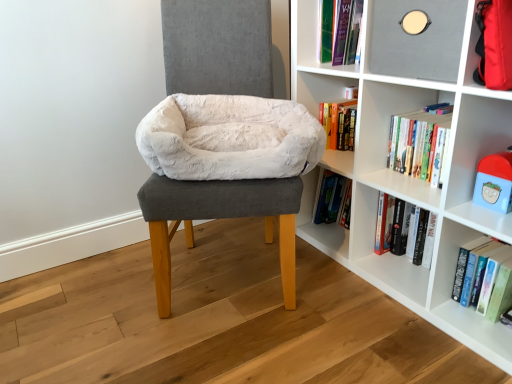
The height and width of the screenshot is (384, 512). What do you see at coordinates (407, 178) in the screenshot? I see `white matte bookshelf at center` at bounding box center [407, 178].

What do you see at coordinates (494, 182) in the screenshot?
I see `white plush toy at upper right` at bounding box center [494, 182].

This screenshot has height=384, width=512. What do you see at coordinates (417, 40) in the screenshot?
I see `matte gray shelf at upper right` at bounding box center [417, 40].

Measure the distance between point (x=263, y=103) and camera.

The distance of point (x=263, y=103) from camera is 4.94 feet.

Where is `white fluffy bean bag at center`? The height and width of the screenshot is (384, 512). white fluffy bean bag at center is located at coordinates (229, 138).

What are the coordinates of `hardcover book at lower right` in the screenshot? It's located at (470, 266).

Find the location of a particular element. This screenshot has width=512, height=384. white plush pet bed at center is located at coordinates (225, 171).

Locate an element on the screen. This screenshot has width=512, height=384. white matte bookshelf at center is located at coordinates (407, 178).

Which object is closer to the camera, white fluffy bean bag at center or white matte bookshelf at center?

white matte bookshelf at center is closer to the camera.

Is white fluffy bean bag at center facing towards white matte bookshelf at center?

No, white fluffy bean bag at center does not turn towards white matte bookshelf at center.

Can you confirm if white fluffy bean bag at center is taller than white matte bookshelf at center?

No, white fluffy bean bag at center is not taller than white matte bookshelf at center.

Is white fluffy bean bag at center to the right of white matte bookshelf at center from the viewer's perspective?

No.

Is matte gray shelf at upper right facing towards hardcover book at lower right?

No, matte gray shelf at upper right is not oriented towards hardcover book at lower right.

How different are the orientations of matte gray shelf at upper right and hardcover book at lower right in degrees?

matte gray shelf at upper right and hardcover book at lower right are facing 0.794 degrees away from each other.

From a real-world perspective, is matte gray shelf at upper right under hardcover book at lower right?

Actually, matte gray shelf at upper right is physically above hardcover book at lower right in the real world.

Locate an element on the screen. chair below the white fluffy bean bag at center (from the image's perspective) is located at coordinates (225, 171).

Are white fluffy bean bag at center and white plush pet bed at center located far from each other?

No, there isn't a large distance between white fluffy bean bag at center and white plush pet bed at center.

Is white fluffy bean bag at center shorter than white plush pet bed at center?

Correct, white fluffy bean bag at center is not as tall as white plush pet bed at center.

Looking at this image, between white plush pet bed at center and white matte bookshelf at center, which one has more height?

With more height is white plush pet bed at center.

Is white plush pet bed at center oriented towards white matte bookshelf at center?

No.

Between white plush pet bed at center and white matte bookshelf at center, which one appears on the right side from the viewer's perspective?

white matte bookshelf at center.

This screenshot has height=384, width=512. I want to click on toy lying on the right of white plush pet bed at center, so click(494, 182).

Who is more distant, white plush pet bed at center or white plush toy at upper right?

white plush toy at upper right.

Which of these two, white plush pet bed at center or white plush toy at upper right, stands taller?

white plush pet bed at center is taller.

Which object is wider, white plush pet bed at center or white plush toy at upper right?

white plush pet bed at center.

Is hardcover book at lower right facing away from white plush toy at upper right?

No.

Are hardcover book at lower right and white plush toy at upper right located far from each other?

hardcover book at lower right is actually quite close to white plush toy at upper right.

Can we say hardcover book at lower right lies outside white plush toy at upper right?

Yes, hardcover book at lower right is located beyond the bounds of white plush toy at upper right.

Does hardcover book at lower right touch white plush pet bed at center?

hardcover book at lower right is not next to white plush pet bed at center, and they're not touching.

Which of these two, hardcover book at lower right or white plush pet bed at center, is thinner?

With smaller width is hardcover book at lower right.

In the image, is hardcover book at lower right on the left side or the right side of white plush pet bed at center?

Clearly, hardcover book at lower right is on the right of white plush pet bed at center in the image.

Which is nearer, [460,266] or [301,116]?

Point [460,266]

Find the location of `shelf that appears in front of the white fluffy bean bag at center`. shelf that appears in front of the white fluffy bean bag at center is located at coordinates (407, 178).

This screenshot has width=512, height=384. Find the location of `gray on the left of hardcover book at lower right`. gray on the left of hardcover book at lower right is located at coordinates (417, 40).

From the picture: When comparing their distances from matte gray shelf at upper right, does white plush toy at upper right or white fluffy bean bag at center seem closer?

white plush toy at upper right is positioned closer to the anchor matte gray shelf at upper right.

Based on their spatial positions, is white matte bookshelf at center or white plush toy at upper right closer to matte gray shelf at upper right?

white matte bookshelf at center is closer to matte gray shelf at upper right.

From the image, which object appears to be nearer to matte gray shelf at upper right, hardcover book at lower right or white plush pet bed at center?

white plush pet bed at center is positioned closer to the anchor matte gray shelf at upper right.

Looking at the image, which one is located further to white plush toy at upper right, white matte bookshelf at center or white fluffy bean bag at center?

white fluffy bean bag at center is further to white plush toy at upper right.

Looking at this image, from the image, which object appears to be farther from white plush pet bed at center, hardcover book at lower right or white fluffy bean bag at center?

hardcover book at lower right.

When comparing their distances from hardcover book at lower right, does white plush toy at upper right or white plush pet bed at center seem closer?

Among the two, white plush toy at upper right is located nearer to hardcover book at lower right.

Estimate the real-world distances between objects in this image. Which object is closer to white fluffy bean bag at center, matte gray shelf at upper right or white plush pet bed at center?

white plush pet bed at center.

Based on their spatial positions, is white plush pet bed at center or matte gray shelf at upper right closer to white plush toy at upper right?

The object closer to white plush toy at upper right is matte gray shelf at upper right.

Identify the location of shelf between white fluffy bean bag at center and hardcover book at lower right in the horizontal direction. (407, 178).

Where is `shelf between matte gray shelf at upper right and white plush toy at upper right from top to bottom`? shelf between matte gray shelf at upper right and white plush toy at upper right from top to bottom is located at coordinates tap(407, 178).

I want to click on shelf between white fluffy bean bag at center and matte gray shelf at upper right, so click(x=407, y=178).

Locate an element on the screen. The height and width of the screenshot is (384, 512). shelf between matte gray shelf at upper right and hardcover book at lower right from top to bottom is located at coordinates (407, 178).